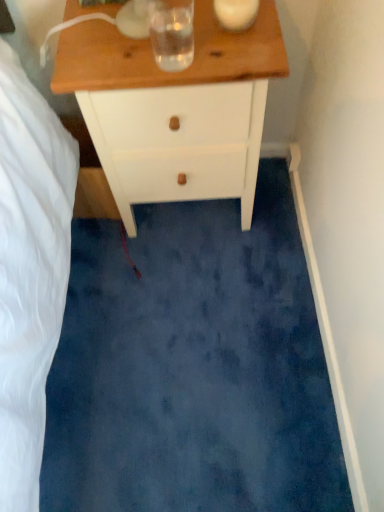
This screenshot has height=512, width=384. Find the location of `vacant area located to the right-hand side of clear glass water at upper center`. vacant area located to the right-hand side of clear glass water at upper center is located at coordinates (230, 53).